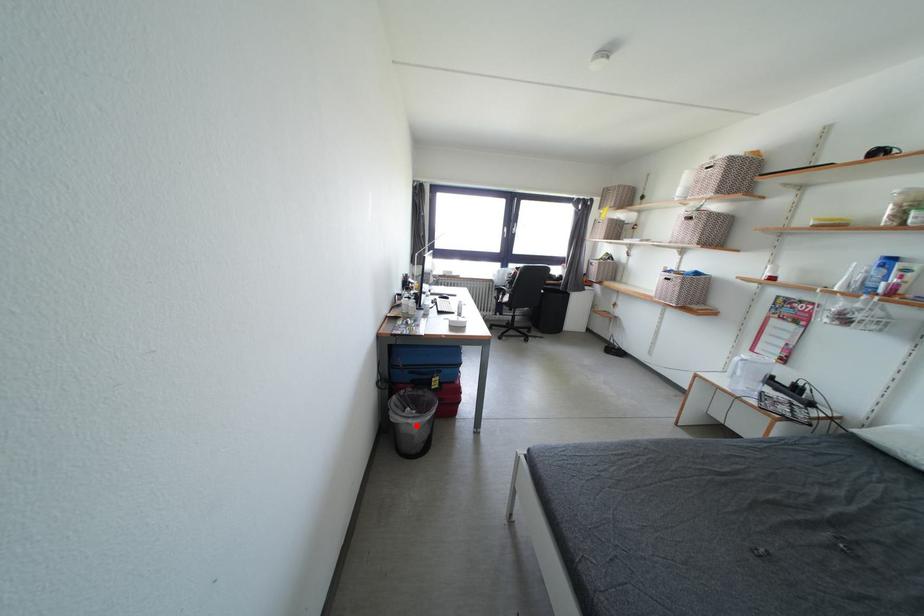
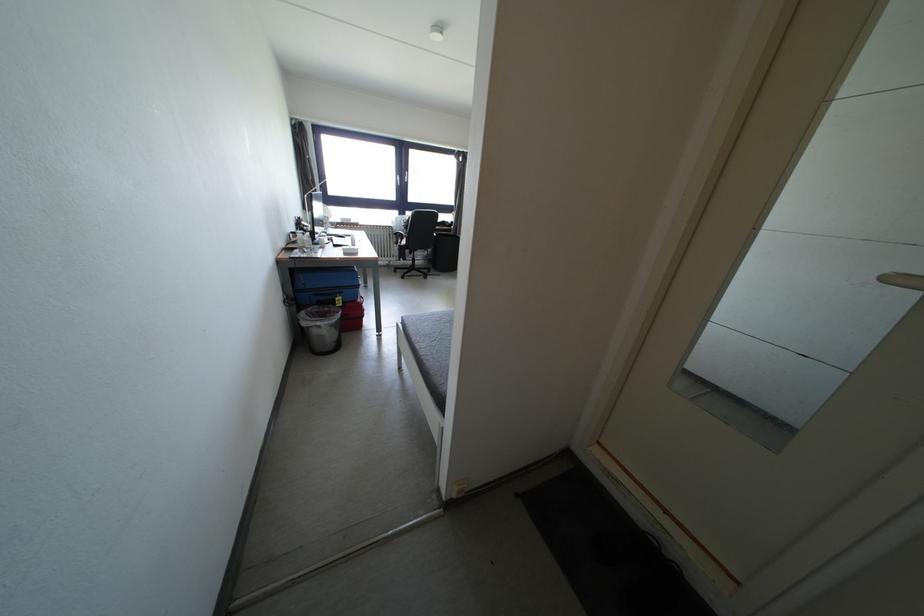
Question: I am providing you with two images of the same scene from different viewpoints. In image1, a red point is highlighted. Considering the same 3D point in image2, which of the following is correct?

Choices:
 (A) It is closer
 (B) It is farther

Answer: (A)